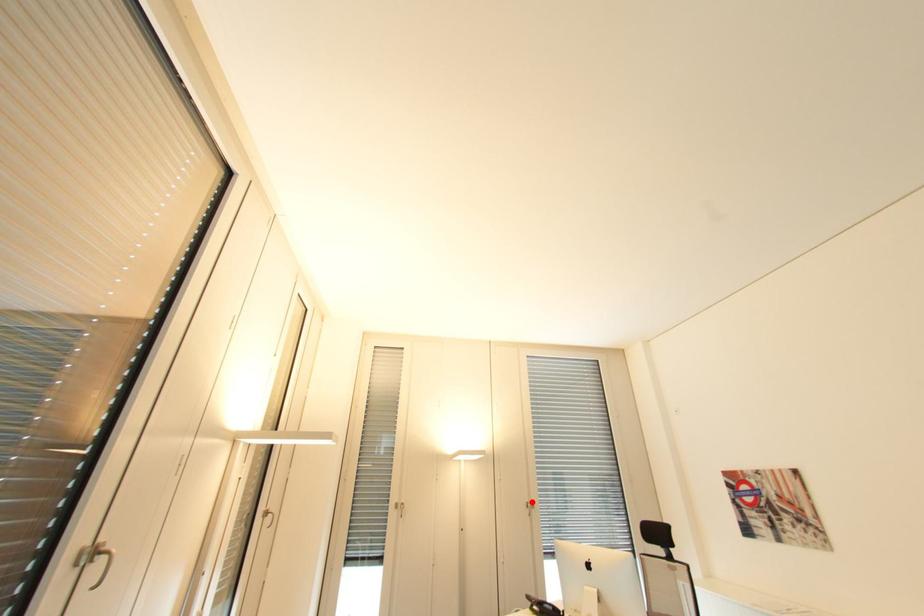
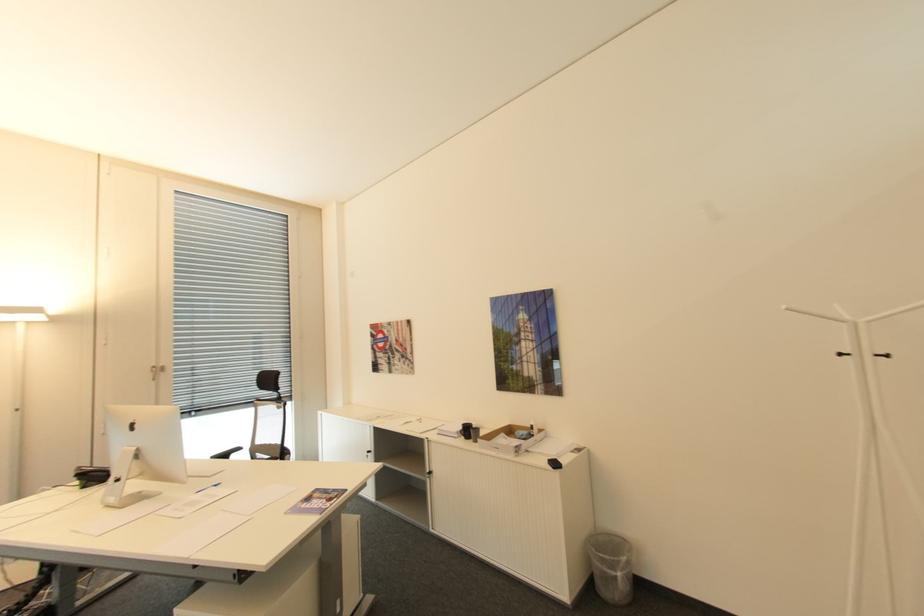
Question: I am providing you with two images of the same scene from different viewpoints. Image1 has a red point marked. In image2, the corresponding 3D location appears at what relative position? Reply with the corresponding letter.

Choices:
 (A) Closer
 (B) Farther

Answer: (A)